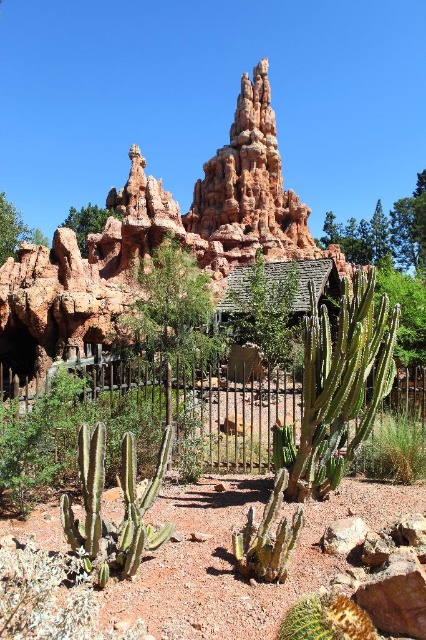
Between iron wire fence at center and rusty corrugated metal hut at center, which one has more height?

iron wire fence at center is taller.

Describe the element at coordinates (201, 404) in the screenshot. I see `iron wire fence at center` at that location.

I want to click on iron wire fence at center, so click(201, 404).

Between iron wire fence at center and green leafy bush at upper left, which one is positioned higher?

green leafy bush at upper left is above.

Who is more forward, (85,404) or (63,224)?

Point (85,404) is more forward.

Locate an element on the screen. iron wire fence at center is located at coordinates (201, 404).

How distant is green spiny cactus at center from green spiky cactus at center?

green spiny cactus at center is 8.65 meters away from green spiky cactus at center.

Is green spiny cactus at center further to camera compared to green spiky cactus at center?

Yes, green spiny cactus at center is behind green spiky cactus at center.

The height and width of the screenshot is (640, 426). I want to click on green spiny cactus at center, so click(x=337, y=387).

Image resolution: width=426 pixels, height=640 pixels. What are the coordinates of `green spiny cactus at center` in the screenshot? It's located at (337, 387).